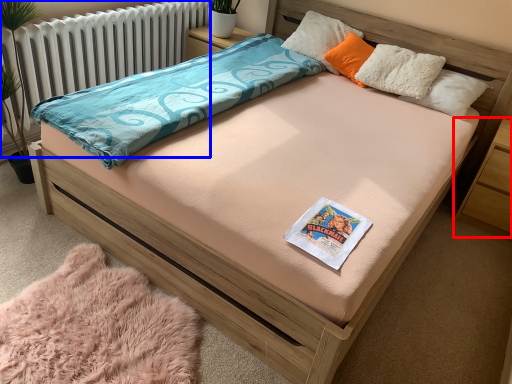
Question: Which object is further to the camera taking this photo, nightstand (highlighted by a red box) or radiator (highlighted by a blue box)?

Choices:
 (A) nightstand
 (B) radiator

Answer: (A)